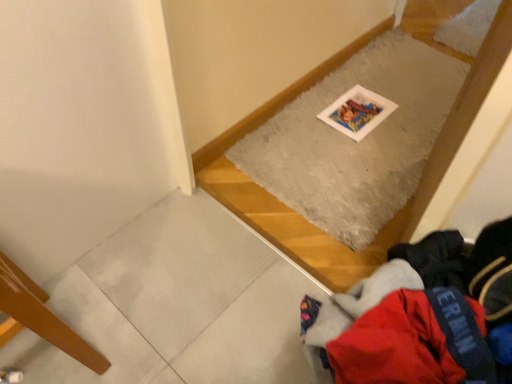
Where is `free area below gray fluffy mat at upper center (from a real-world perspective)`? free area below gray fluffy mat at upper center (from a real-world perspective) is located at coordinates (380, 125).